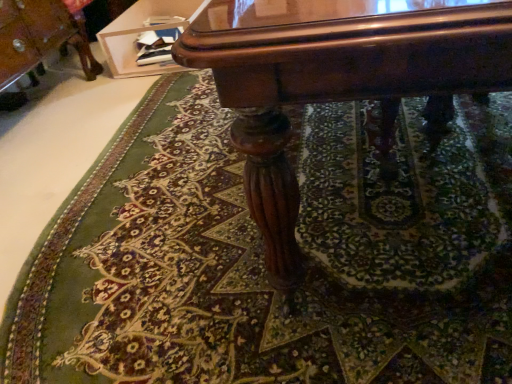
Question: From a real-world perspective, is wooden glossy vanity at upper center positioned under glossy wood table at center based on gravity?

Choices:
 (A) no
 (B) yes

Answer: (B)

Question: Does wooden glossy vanity at upper center appear on the left side of glossy wood table at center?

Choices:
 (A) yes
 (B) no

Answer: (A)

Question: Is wooden glossy vanity at upper center facing towards glossy wood table at center?

Choices:
 (A) yes
 (B) no

Answer: (B)

Question: Does wooden glossy vanity at upper center have a lesser height compared to glossy wood table at center?

Choices:
 (A) yes
 (B) no

Answer: (A)

Question: Can you confirm if wooden glossy vanity at upper center is smaller than glossy wood table at center?

Choices:
 (A) no
 (B) yes

Answer: (B)

Question: Does wooden glossy vanity at upper center have a greater height compared to glossy wood table at center?

Choices:
 (A) yes
 (B) no

Answer: (B)

Question: Is glossy wood table at center far from wooden glossy vanity at upper center?

Choices:
 (A) no
 (B) yes

Answer: (B)

Question: From the image's perspective, is glossy wood table at center beneath wooden glossy vanity at upper center?

Choices:
 (A) yes
 (B) no

Answer: (A)

Question: Is glossy wood table at center bigger than wooden glossy vanity at upper center?

Choices:
 (A) yes
 (B) no

Answer: (A)

Question: Is glossy wood table at center looking in the opposite direction of wooden glossy vanity at upper center?

Choices:
 (A) no
 (B) yes

Answer: (A)

Question: Can you confirm if glossy wood table at center is shorter than wooden glossy vanity at upper center?

Choices:
 (A) yes
 (B) no

Answer: (B)

Question: Considering the relative sizes of glossy wood table at center and wooden glossy vanity at upper center in the image provided, is glossy wood table at center taller than wooden glossy vanity at upper center?

Choices:
 (A) yes
 (B) no

Answer: (A)

Question: Based on their positions, is wooden glossy vanity at upper center located to the left or right of glossy wood table at center?

Choices:
 (A) right
 (B) left

Answer: (B)